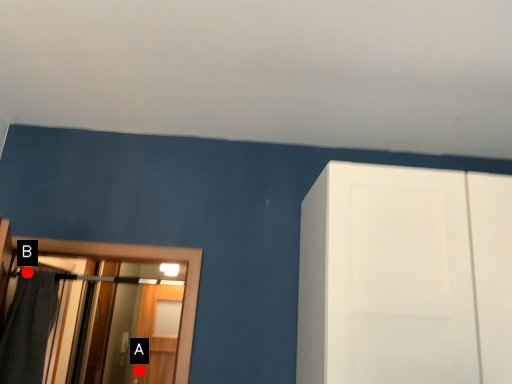
Question: Two points are circled on the image, labeled by A and B beside each circle. Which point is closer to the camera?

Choices:
 (A) A is closer
 (B) B is closer

Answer: (B)